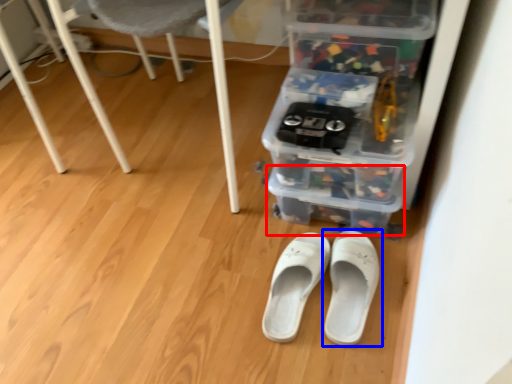
Question: Among these objects, which one is farthest to the camera, storage box (highlighted by a red box) or footwear (highlighted by a blue box)?

Choices:
 (A) storage box
 (B) footwear

Answer: (A)